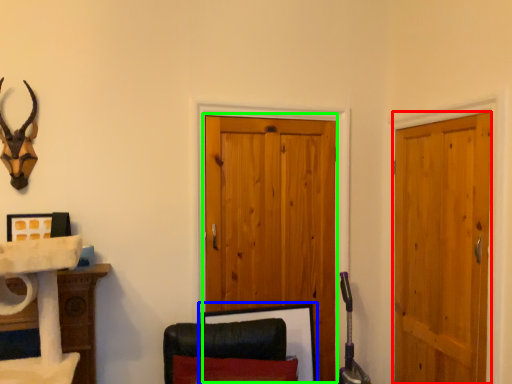
Question: Which object is positioned farthest from door (highlighted by a red box)? Select from picture frame (highlighted by a blue box) and barn door (highlighted by a green box).

Choices:
 (A) picture frame
 (B) barn door

Answer: (A)